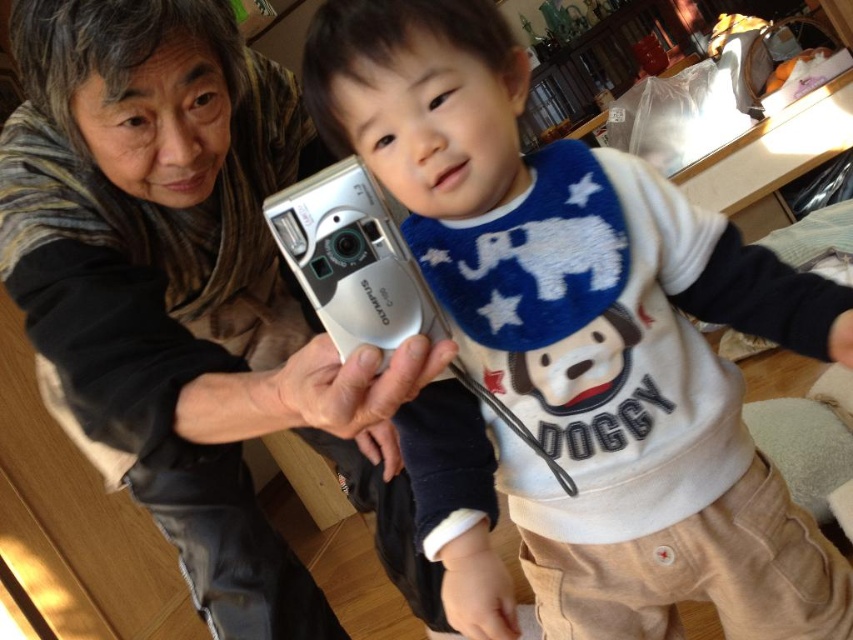
You are a photographer setting up a photo shoot. You have a white soft fabric bib at center and a matte silver camera at center. The client wants to ensure the bib is visible in the final photo. Based on their positions, which object should be moved to achieve this?

The white soft fabric bib at center is positioned on the right side of the matte silver camera at center. To ensure the bib is visible, you should move the matte silver camera at center to the left so the bib at center is no longer blocked.

You are a photographer trying to capture a closeup shot of the white soft fabric bib at center using the matte silver camera at center. What is the minimum distance you should keep between the camera and the bib to ensure the subject is in focus?

The minimum distance should be at least 14.53 inches to ensure the white soft fabric bib at center is in focus with the matte silver camera at center.